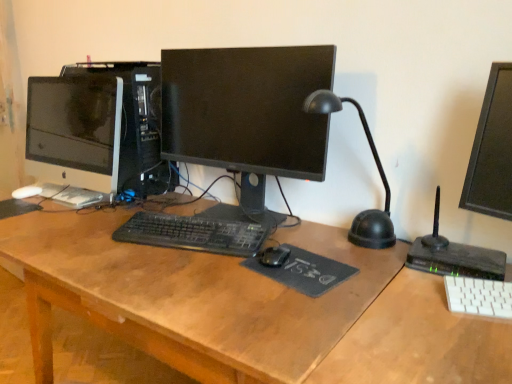
Question: From a real-world perspective, does black plastic desk lamp at center right sit lower than black rubber mousepad at center, which appears as the 2th mousepad when viewed from the right?

Choices:
 (A) yes
 (B) no

Answer: (B)

Question: Would you say black plastic desk lamp at center right contains black rubber mousepad at center, marked as the 1th mousepad in a top-to-bottom arrangement?

Choices:
 (A) no
 (B) yes

Answer: (A)

Question: Is black plastic desk lamp at center right at the right side of black rubber mousepad at center, which is the second mousepad from bottom to top?

Choices:
 (A) yes
 (B) no

Answer: (A)

Question: Does black plastic desk lamp at center right lie behind black rubber mousepad at center, which appears as the 1th mousepad when viewed from the left?

Choices:
 (A) yes
 (B) no

Answer: (B)

Question: Is black plastic desk lamp at center right outside black rubber mousepad at center, which is the second mousepad from bottom to top?

Choices:
 (A) no
 (B) yes

Answer: (B)

Question: From the image's perspective, is black plastic desk lamp at center right under black rubber mousepad at center, which appears as the 2th mousepad when viewed from the right?

Choices:
 (A) no
 (B) yes

Answer: (A)

Question: Is black fabric mousepad at center, placed as the 2th mousepad when sorted from left to right, thinner than white plastic keyboard at lower right, which ranks as the 1th computer keyboard in bottom-to-top order?

Choices:
 (A) yes
 (B) no

Answer: (B)

Question: Is black fabric mousepad at center, marked as the 2th mousepad in a top-to-bottom arrangement, with white plastic keyboard at lower right, the 1th computer keyboard in the front-to-back sequence?

Choices:
 (A) no
 (B) yes

Answer: (A)

Question: From the image's perspective, is black fabric mousepad at center, positioned as the 2th mousepad in back-to-front order, beneath white plastic keyboard at lower right, which ranks as the 1th computer keyboard in bottom-to-top order?

Choices:
 (A) no
 (B) yes

Answer: (A)

Question: Does black fabric mousepad at center, the 1th mousepad positioned from the bottom, have a smaller size compared to white plastic keyboard at lower right, which ranks as the second computer keyboard in left-to-right order?

Choices:
 (A) yes
 (B) no

Answer: (A)

Question: Would you say white plastic keyboard at lower right, which ranks as the 2th computer keyboard in back-to-front order, is part of black fabric mousepad at center, which appears as the 1th mousepad when viewed from the front,'s contents?

Choices:
 (A) no
 (B) yes

Answer: (A)

Question: From the image's perspective, would you say black fabric mousepad at center, which is the first mousepad in right-to-left order, is positioned over white plastic keyboard at lower right, the 1th computer keyboard in the front-to-back sequence?

Choices:
 (A) no
 (B) yes

Answer: (B)

Question: Can black fabric mousepad at center, positioned as the 2th mousepad in back-to-front order, be found inside black plastic computer tower at center?

Choices:
 (A) yes
 (B) no

Answer: (B)